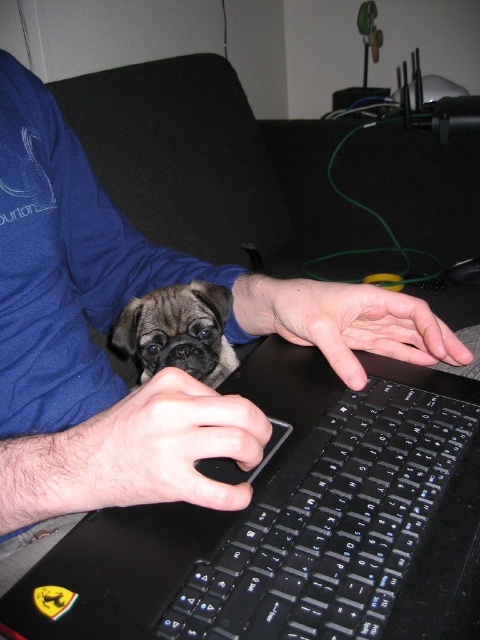
You are a photographer trying to capture a closeup of the fuzzy brown dog at center without blocking the black matte mouse at center. Based on the scene, where should you position the dog relative to the mouse?

The black matte mouse at center is below the fuzzy brown dog at center, so to avoid blocking the mouse, position the dog above the mouse.

You are trying to locate your mouse while using the laptop. Based on the scene, where is the black matte mouse at center in relation to the black plastic keyboard at lower center?

The black matte mouse at center is above the black plastic keyboard at lower center.

You need to place a new keyboard cover that exactly fits the black plastic keyboard at lower center. If the smooth skin hand at center currently covers half of the keyboard, will the cover fit properly once the hand is removed?

The black plastic keyboard at lower center is wider than the smooth skin hand at center. Since the hand only covers half of the keyboard, removing it would leave the entire keyboard exposed, allowing the cover to fit properly as it matches the keyboard dimensions.